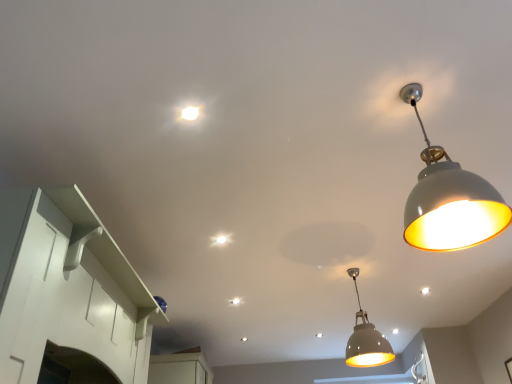
Question: In which direction should I rotate to look at matte white pendant light at center, the first lamp in the bottom-to-top sequence?

Choices:
 (A) right
 (B) left

Answer: (A)

Question: From a real-world perspective, is white glossy light bulb at upper center below white glossy cabinet at left?

Choices:
 (A) yes
 (B) no

Answer: (B)

Question: Is white glossy cabinet at left completely or partially inside white glossy light bulb at upper center?

Choices:
 (A) no
 (B) yes

Answer: (A)

Question: From the image's perspective, does white glossy light bulb at upper center appear higher than white glossy cabinet at left?

Choices:
 (A) no
 (B) yes

Answer: (B)

Question: Is white glossy light bulb at upper center looking in the opposite direction of white glossy cabinet at left?

Choices:
 (A) yes
 (B) no

Answer: (B)

Question: From a real-world perspective, is white glossy light bulb at upper center on white glossy cabinet at left?

Choices:
 (A) yes
 (B) no

Answer: (A)

Question: Is white glossy light bulb at upper center oriented towards white glossy cabinet at left?

Choices:
 (A) no
 (B) yes

Answer: (A)

Question: Is white glossy pendant light at upper right, which is the first lamp in front-to-back order, far from white glossy cabinet at left?

Choices:
 (A) no
 (B) yes

Answer: (B)

Question: Does white glossy pendant light at upper right, which is the first lamp in front-to-back order, appear on the right side of white glossy cabinet at left?

Choices:
 (A) yes
 (B) no

Answer: (A)

Question: Can you confirm if white glossy pendant light at upper right, the second lamp from the bottom, is taller than white glossy cabinet at left?

Choices:
 (A) yes
 (B) no

Answer: (A)

Question: Is white glossy pendant light at upper right, which is counted as the first lamp, starting from the top, at the left side of white glossy cabinet at left?

Choices:
 (A) no
 (B) yes

Answer: (A)

Question: Is white glossy pendant light at upper right, which is counted as the first lamp, starting from the top, in contact with white glossy cabinet at left?

Choices:
 (A) no
 (B) yes

Answer: (A)

Question: Is white glossy pendant light at upper right, which is the second lamp from back to front, bigger than white glossy cabinet at left?

Choices:
 (A) no
 (B) yes

Answer: (B)

Question: Is white glossy cabinet at left positioned behind matte white pendant light at center, the first lamp in the bottom-to-top sequence?

Choices:
 (A) yes
 (B) no

Answer: (B)